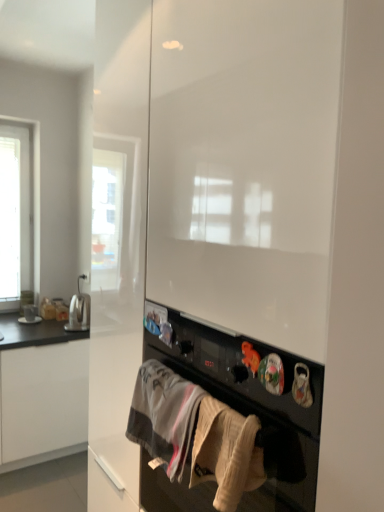
The height and width of the screenshot is (512, 384). I want to click on vacant space to the left of satin silver toaster at left, so click(48, 331).